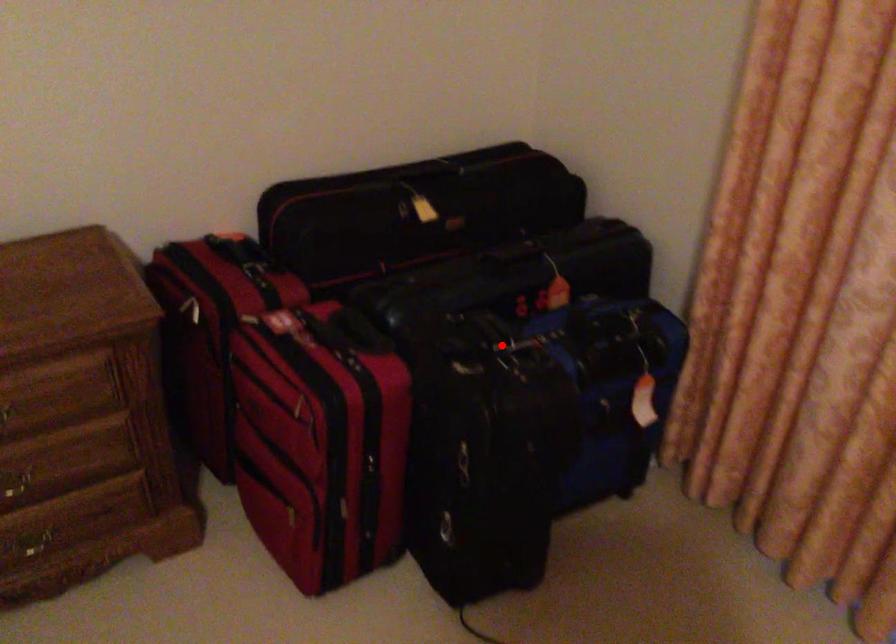
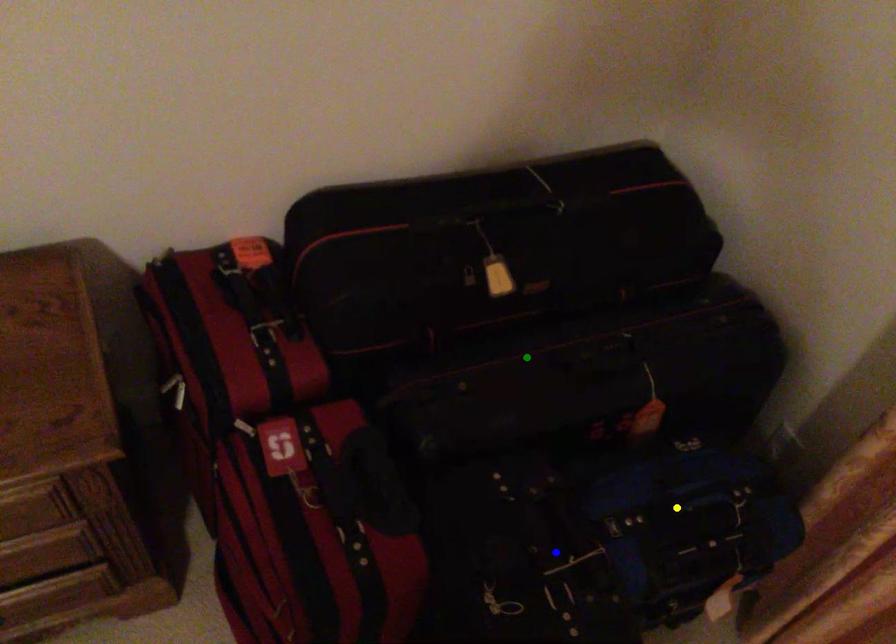
Question: I am providing you with two images of the same scene from different viewpoints. A red point is marked on the first image. You are given multiple points on the second image. Which spot in image 2 lines up with the point in image 1?

Choices:
 (A) yellow point
 (B) blue point
 (C) green point

Answer: (B)